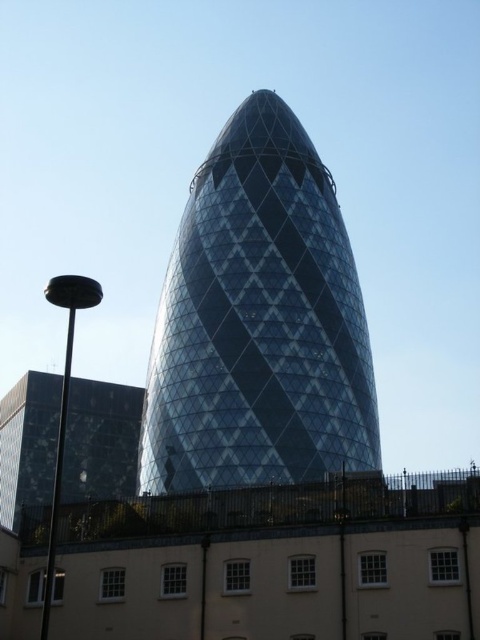
Which is more to the right, transparent glass tower at center or glassy reflective building at lower left?

From the viewer's perspective, transparent glass tower at center appears more on the right side.

Does point (290, 177) lie in front of point (110, 417)?

Yes, point (290, 177) is closer to viewer.

Which is in front, point (338, 243) or point (129, 461)?

Point (338, 243)

Identify the location of transparent glass tower at center. click(259, 321).